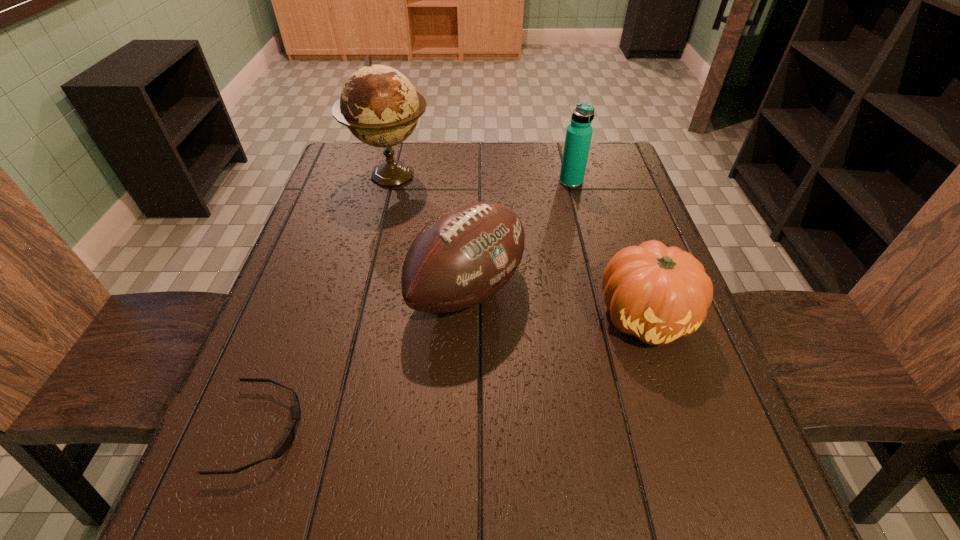
Find the location of `vacant area between the water bottle and the globe`. vacant area between the water bottle and the globe is located at coordinates (481, 179).

Identify the location of object that can be found as the second closest to the second shortest object. (579, 132).

Locate an element on the screen. Image resolution: width=960 pixels, height=540 pixels. the fourth closest object relative to the second shortest object is located at coordinates (288, 440).

At what (x,y) coordinates should I click in order to perform the action: click on free spot that satisfies the following two spatial constraints: 1. on the carved face of the fourth tallest object; 2. on the front-facing side of the sunglasses. Please return your answer as a coordinate pair (x, y). Image resolution: width=960 pixels, height=540 pixels. Looking at the image, I should click on tap(683, 429).

Locate an element on the screen. This screenshot has width=960, height=540. vacant point that satisfies the following two spatial constraints: 1. on the front of the football (American) showing Asia; 2. on the left side of the tallest object is located at coordinates (363, 290).

I want to click on vacant space that satisfies the following two spatial constraints: 1. on the front of the water bottle showing Asia; 2. on the left side of the globe, so click(390, 182).

Where is `free space in the image that satisfies the following two spatial constraints: 1. on the front of the water bottle showing Asia; 2. on the right side of the globe`? The image size is (960, 540). free space in the image that satisfies the following two spatial constraints: 1. on the front of the water bottle showing Asia; 2. on the right side of the globe is located at coordinates (390, 182).